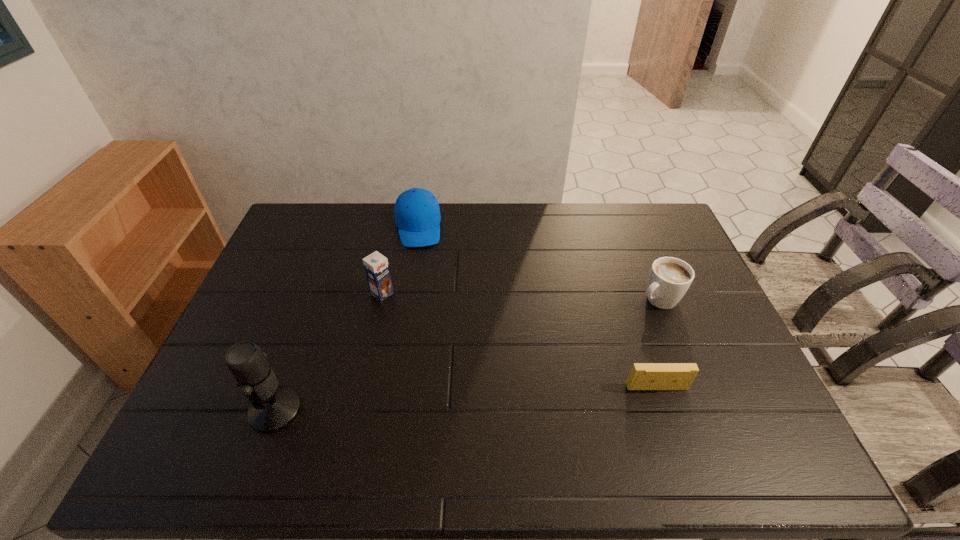
In order to click on blank region between the microphone and the videotape in this screenshot , I will do `click(466, 399)`.

I want to click on vacant space that's between the fourth shortest object and the cap, so click(400, 260).

Find the location of a particular element. The image size is (960, 540). free space between the fourth shortest object and the cap is located at coordinates (400, 260).

You are a GUI agent. You are given a task and a screenshot of the screen. Output one action in this format:
    pyautogui.click(x=<x>, y=<y>)
    Task: Click on the unoccupied area between the chocolate milk and the leftmost object
    This screenshot has width=960, height=540.
    Given the screenshot: What is the action you would take?
    pyautogui.click(x=329, y=352)

Locate an element on the screen. free area in between the videotape and the second tallest object is located at coordinates (519, 341).

Where is `free space between the leftmost object and the shortest object`? The width and height of the screenshot is (960, 540). free space between the leftmost object and the shortest object is located at coordinates (466, 399).

Where is `free space that is in between the farthest object and the fourth shortest object`? The width and height of the screenshot is (960, 540). free space that is in between the farthest object and the fourth shortest object is located at coordinates (400, 260).

I want to click on free point between the chocolate milk and the shortest object, so [519, 341].

Identify which object is located as the fourth nearest to the cap. Please provide its 2D coordinates. Your answer should be formatted as a tuple, i.e. [(x, y)], where the tuple contains the x and y coordinates of a point satisfying the conditions above.

[(643, 376)]

Locate an element on the screen. The width and height of the screenshot is (960, 540). object that is the fourth closest to the cappuccino is located at coordinates point(273,407).